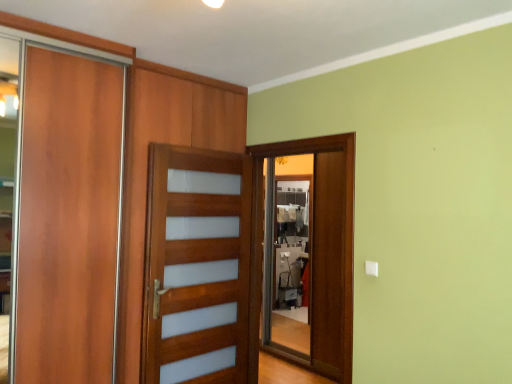
Question: Which direction should I rotate to look at translucent wood screen door at center, the 2th screen door in the right-to-left sequence?

Choices:
 (A) left
 (B) right

Answer: (A)

Question: From the image's perspective, would you say translucent wood screen door at center, the 2th screen door in the right-to-left sequence, is shown under wooden screen door at center, the second screen door positioned from the left?

Choices:
 (A) no
 (B) yes

Answer: (B)

Question: Does translucent wood screen door at center, the 2th screen door in the right-to-left sequence, come in front of wooden screen door at center, which is counted as the 1th screen door, starting from the right?

Choices:
 (A) yes
 (B) no

Answer: (A)

Question: Is translucent wood screen door at center, the first screen door positioned from the left, looking in the opposite direction of wooden screen door at center, the second screen door positioned from the left?

Choices:
 (A) yes
 (B) no

Answer: (B)

Question: Considering the relative sizes of translucent wood screen door at center, the first screen door positioned from the left, and wooden screen door at center, the second screen door positioned from the left, in the image provided, is translucent wood screen door at center, the first screen door positioned from the left, shorter than wooden screen door at center, the second screen door positioned from the left,?

Choices:
 (A) no
 (B) yes

Answer: (B)

Question: From a real-world perspective, does translucent wood screen door at center, the 2th screen door in the right-to-left sequence, stand above wooden screen door at center, the second screen door positioned from the left?

Choices:
 (A) no
 (B) yes

Answer: (A)

Question: Would you say translucent wood screen door at center, the 2th screen door in the right-to-left sequence, is outside wooden screen door at center, the second screen door positioned from the left?

Choices:
 (A) no
 (B) yes

Answer: (B)

Question: Considering the relative sizes of wooden screen door at center, the second screen door positioned from the left, and translucent wood screen door at center, the first screen door positioned from the left, in the image provided, is wooden screen door at center, the second screen door positioned from the left, bigger than translucent wood screen door at center, the first screen door positioned from the left,?

Choices:
 (A) yes
 (B) no

Answer: (B)

Question: From a real-world perspective, does wooden screen door at center, which is counted as the 1th screen door, starting from the right, stand above translucent wood screen door at center, the 2th screen door in the right-to-left sequence?

Choices:
 (A) no
 (B) yes

Answer: (B)

Question: Does wooden screen door at center, which is counted as the 1th screen door, starting from the right, have a lesser width compared to translucent wood screen door at center, the 2th screen door in the right-to-left sequence?

Choices:
 (A) yes
 (B) no

Answer: (A)

Question: Is wooden screen door at center, which is counted as the 1th screen door, starting from the right, far away from translucent wood screen door at center, the 2th screen door in the right-to-left sequence?

Choices:
 (A) no
 (B) yes

Answer: (B)

Question: Does wooden screen door at center, the second screen door positioned from the left, have a greater width compared to translucent wood screen door at center, the first screen door positioned from the left?

Choices:
 (A) no
 (B) yes

Answer: (A)

Question: Is wooden screen door at center, which is counted as the 1th screen door, starting from the right, oriented towards translucent wood screen door at center, the first screen door positioned from the left?

Choices:
 (A) yes
 (B) no

Answer: (A)

Question: Which is correct: translucent wood screen door at center, the first screen door positioned from the left, is inside wooden screen door at center, the second screen door positioned from the left, or outside of it?

Choices:
 (A) outside
 (B) inside

Answer: (A)